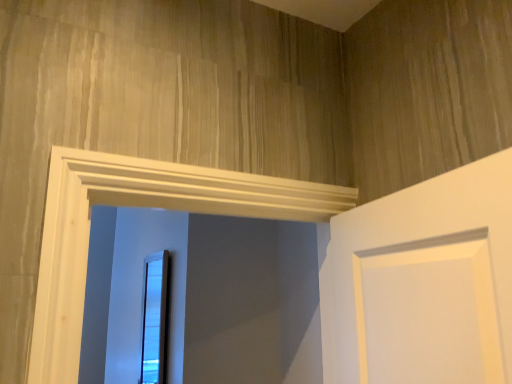
Describe the element at coordinates (154, 318) in the screenshot. This screenshot has width=512, height=384. I see `wooden frame at center` at that location.

Where is `wooden frame at center`? wooden frame at center is located at coordinates 154,318.

At what (x,y) coordinates should I click in order to perform the action: click on wooden frame at center. Please return your answer as a coordinate pair (x, y). Looking at the image, I should click on (154, 318).